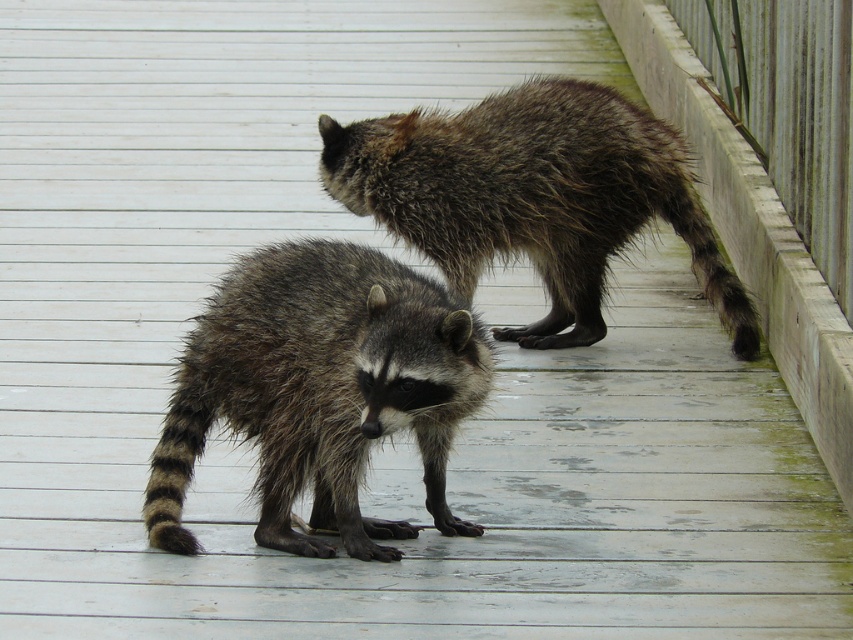
Question: Which point appears farthest from the camera in this image?

Choices:
 (A) (556, 77)
 (B) (248, 420)

Answer: (A)

Question: Does rough fur raccoon at center have a greater width compared to fuzzy brown raccoon at upper center?

Choices:
 (A) yes
 (B) no

Answer: (B)

Question: Among these objects, which one is farthest from the camera?

Choices:
 (A) fuzzy brown raccoon at upper center
 (B) rough fur raccoon at center

Answer: (A)

Question: Can you confirm if rough fur raccoon at center is thinner than fuzzy brown raccoon at upper center?

Choices:
 (A) yes
 (B) no

Answer: (A)

Question: Is rough fur raccoon at center bigger than fuzzy brown raccoon at upper center?

Choices:
 (A) no
 (B) yes

Answer: (A)